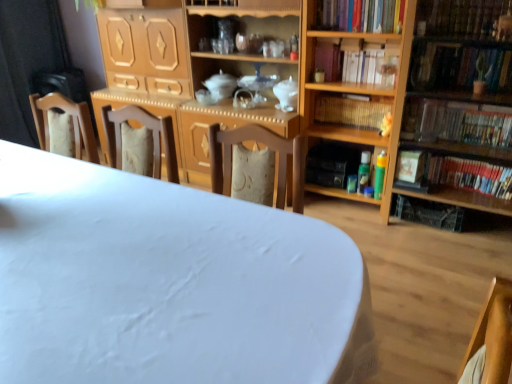
Question: From a real-world perspective, is hardcover book at right, the sixth book positioned from the top, located beneath white matte table at center?

Choices:
 (A) no
 (B) yes

Answer: (B)

Question: Is hardcover book at right, the first book when ordered from bottom to top, outside of white matte table at center?

Choices:
 (A) no
 (B) yes

Answer: (B)

Question: Is hardcover book at right, the sixth book positioned from the top, at the right side of white matte table at center?

Choices:
 (A) yes
 (B) no

Answer: (A)

Question: Is the position of hardcover book at right, the sixth book positioned from the top, more distant than that of white matte table at center?

Choices:
 (A) no
 (B) yes

Answer: (B)

Question: Could you tell me if hardcover book at right, the first book when ordered from bottom to top, is turned towards white matte table at center?

Choices:
 (A) no
 (B) yes

Answer: (B)

Question: Considering the relative positions of wooden bookshelf at right, marked as the 1th shelf in a right-to-left arrangement, and wooden bookshelf at center, positioned as the third book in bottom-to-top order, in the image provided, is wooden bookshelf at right, marked as the 1th shelf in a right-to-left arrangement, to the left or to the right of wooden bookshelf at center, positioned as the third book in bottom-to-top order,?

Choices:
 (A) left
 (B) right

Answer: (B)

Question: From their relative heights in the image, would you say wooden bookshelf at right, marked as the 1th shelf in a right-to-left arrangement, is taller or shorter than wooden bookshelf at center, positioned as the third book in bottom-to-top order?

Choices:
 (A) tall
 (B) short

Answer: (A)

Question: Is wooden bookshelf at right, marked as the 1th shelf in a right-to-left arrangement, in front of or behind wooden bookshelf at center, positioned as the third book in bottom-to-top order, in the image?

Choices:
 (A) behind
 (B) front

Answer: (B)

Question: Looking at the image, does wooden bookshelf at right, marked as the 1th shelf in a right-to-left arrangement, seem bigger or smaller compared to wooden bookshelf at center, positioned as the third book in bottom-to-top order?

Choices:
 (A) big
 (B) small

Answer: (A)

Question: Considering the positions of wooden bookshelf at right, which is the 2th shelf from right to left, and green matte plant at upper right, which is the 4th book in bottom-to-top order, in the image, is wooden bookshelf at right, which is the 2th shelf from right to left, bigger or smaller than green matte plant at upper right, which is the 4th book in bottom-to-top order,?

Choices:
 (A) small
 (B) big

Answer: (B)

Question: Relative to green matte plant at upper right, which is the 4th book in bottom-to-top order, is wooden bookshelf at right, the first shelf viewed from the left, in front or behind?

Choices:
 (A) front
 (B) behind

Answer: (B)

Question: Does point (407, 59) appear closer or farther from the camera than point (418, 59)?

Choices:
 (A) closer
 (B) farther

Answer: (A)

Question: In the image, is wooden bookshelf at right, which is the 2th shelf from right to left, on the left side or the right side of green matte plant at upper right, which is the 4th book in bottom-to-top order?

Choices:
 (A) right
 (B) left

Answer: (B)

Question: Considering the relative positions of wooden bookshelf at right, positioned as the 2th shelf in left-to-right order, and hardcover book at right, which is counted as the fifth book, starting from the top, in the image provided, is wooden bookshelf at right, positioned as the 2th shelf in left-to-right order, to the left or to the right of hardcover book at right, which is counted as the fifth book, starting from the top,?

Choices:
 (A) right
 (B) left

Answer: (A)

Question: Looking at their shapes, would you say wooden bookshelf at right, marked as the 1th shelf in a right-to-left arrangement, is wider or thinner than hardcover book at right, the second book ordered from the bottom?

Choices:
 (A) wide
 (B) thin

Answer: (A)